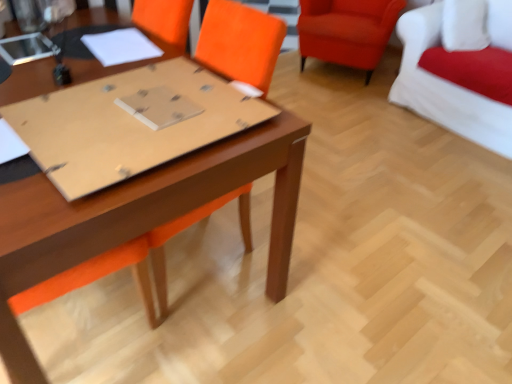
I want to click on vacant area that is in front of white paper at center, so click(111, 72).